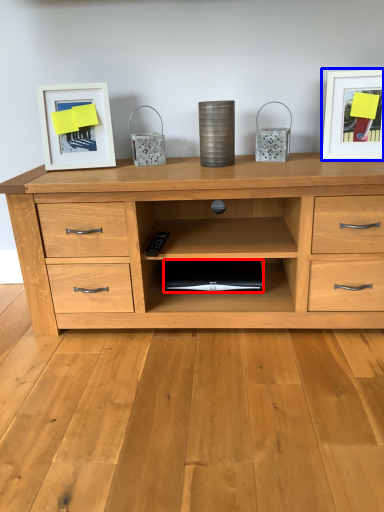
Question: Among these objects, which one is farthest to the camera, computer (highlighted by a red box) or picture frame (highlighted by a blue box)?

Choices:
 (A) computer
 (B) picture frame

Answer: (A)